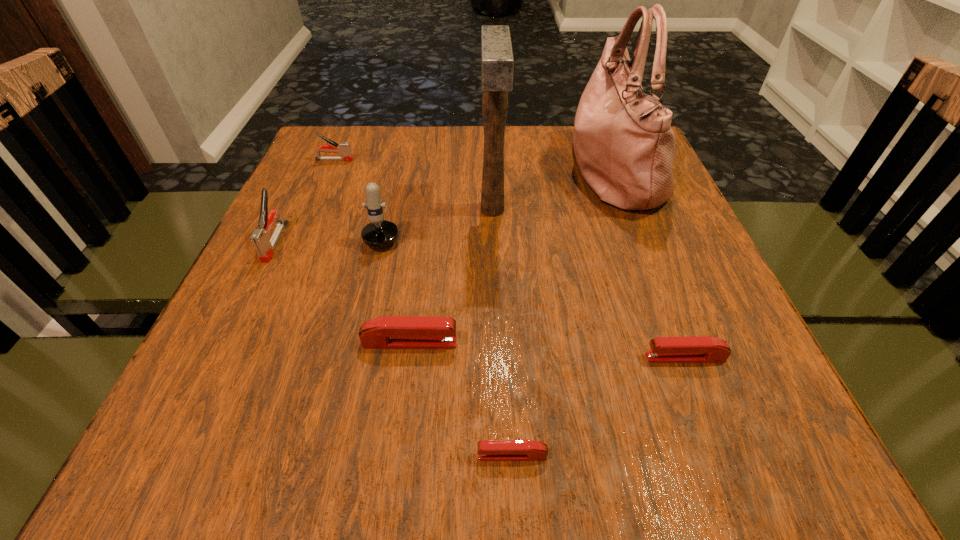
Image resolution: width=960 pixels, height=540 pixels. In order to click on vacant region located on the handle side of the fourth shortest object in this screenshot , I will do `click(503, 160)`.

This screenshot has height=540, width=960. In order to click on vacant space situated 0.250m on the front-facing side of the third shortest stapler in this screenshot , I will do `click(613, 342)`.

The image size is (960, 540). I want to click on free location located on the front-facing side of the rightmost stapler, so click(x=517, y=357).

This screenshot has height=540, width=960. In order to click on vacant space situated on the front-facing side of the rightmost stapler in this screenshot , I will do click(x=421, y=357).

Identify the location of vacant area situated on the front-facing side of the rightmost stapler. (467, 357).

This screenshot has height=540, width=960. Find the location of `vacant space located on the front-facing side of the smallest red stapler`. vacant space located on the front-facing side of the smallest red stapler is located at coordinates [x=318, y=455].

Identify the location of vacant area situated on the front-facing side of the smallest red stapler. (219, 455).

Where is `free space located on the front-facing side of the smallest red stapler`? This screenshot has height=540, width=960. free space located on the front-facing side of the smallest red stapler is located at coordinates (401, 455).

At what (x,y) coordinates should I click in order to perform the action: click on handbag at the far edge. Please return your answer as a coordinate pair (x, y). Looking at the image, I should click on coord(624,145).

At what (x,y) coordinates should I click in order to perform the action: click on stapler present at the far edge. Please return your answer as a coordinate pair (x, y). The image size is (960, 540). Looking at the image, I should click on (344, 149).